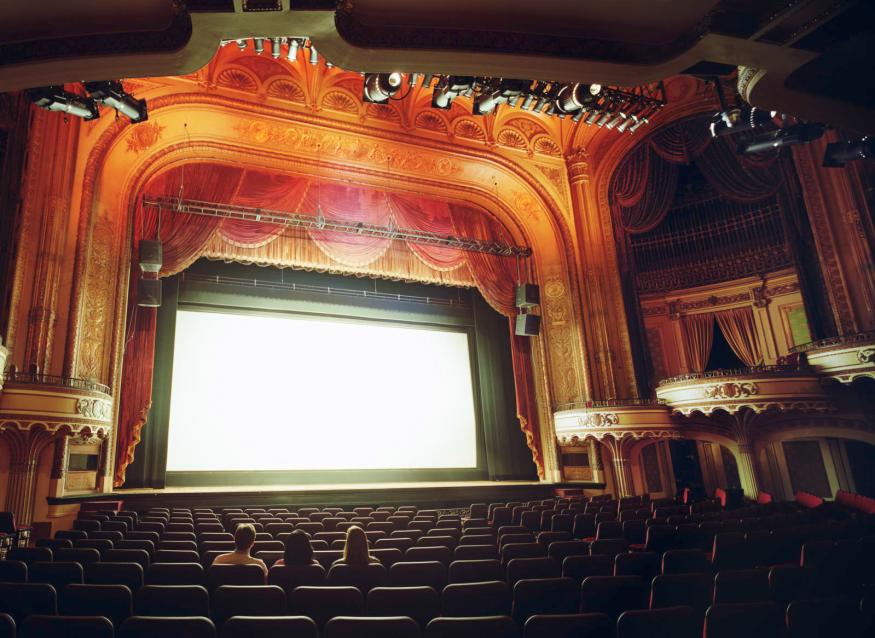
Identify the location of brown walls. The height and width of the screenshot is (638, 875). (849, 256).